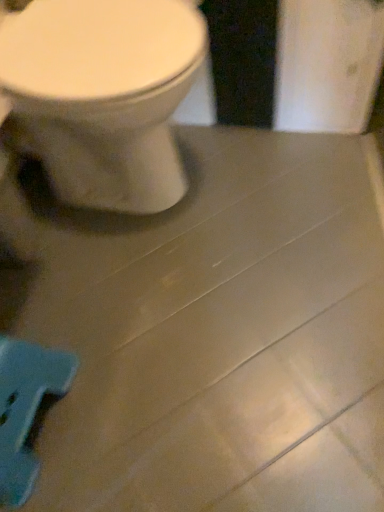
The width and height of the screenshot is (384, 512). In order to click on vacant area that lies between white glossy toilet at upper left and blue plastic toy at lower left in this screenshot , I will do `click(95, 304)`.